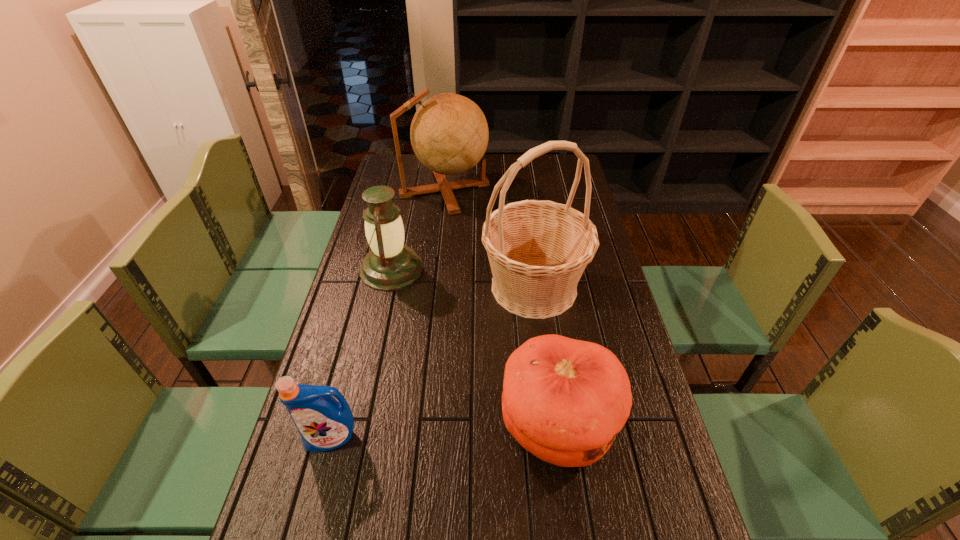
You are a GUI agent. You are given a task and a screenshot of the screen. Output one action in this format:
    pyautogui.click(x=<x>, y=<y>)
    Task: Click on the basket
    The height and width of the screenshot is (540, 960).
    Given the screenshot: What is the action you would take?
    pyautogui.click(x=538, y=250)

This screenshot has height=540, width=960. Identify the location of globe. (449, 134).

The height and width of the screenshot is (540, 960). In order to click on the farthest object in this screenshot , I will do `click(449, 134)`.

Identify the location of lantern. This screenshot has width=960, height=540. (390, 265).

Where is `pumpkin`? The image size is (960, 540). pumpkin is located at coordinates (564, 400).

What are the coordinates of `detergent` in the screenshot? It's located at (324, 424).

At what (x,y) coordinates should I click in order to perform the action: click on vacant space located 0.070m on the right of the basket. Please return your answer as a coordinate pair (x, y). Looking at the image, I should click on (609, 287).

This screenshot has width=960, height=540. I want to click on free space located 0.150m on the surface of the farthest object, so click(x=526, y=190).

Locate an element on the screen. Image resolution: width=960 pixels, height=540 pixels. vacant space located with the light compartment facing forward on the lantern is located at coordinates (439, 269).

The image size is (960, 540). Find the location of `vacant space located 0.290m on the back of the pumpkin`. vacant space located 0.290m on the back of the pumpkin is located at coordinates (540, 298).